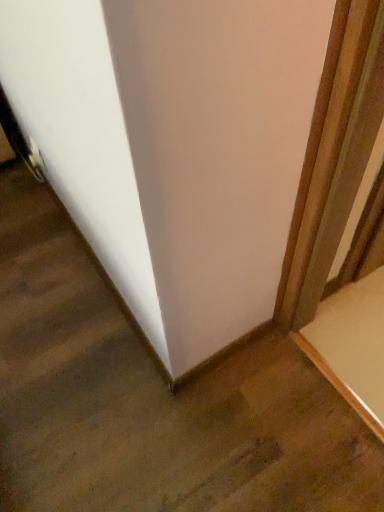
Describe the element at coordinates (151, 399) in the screenshot. Image resolution: width=384 pixels, height=512 pixels. I see `white glossy wall at center` at that location.

In order to face white glossy wall at center, should I rotate leftwards or rightwards?

To align with it, rotate left about 14.798°.

I want to click on white glossy wall at center, so pyautogui.click(x=151, y=399).

Identify the location of white glossy wall at center. The image size is (384, 512). (151, 399).